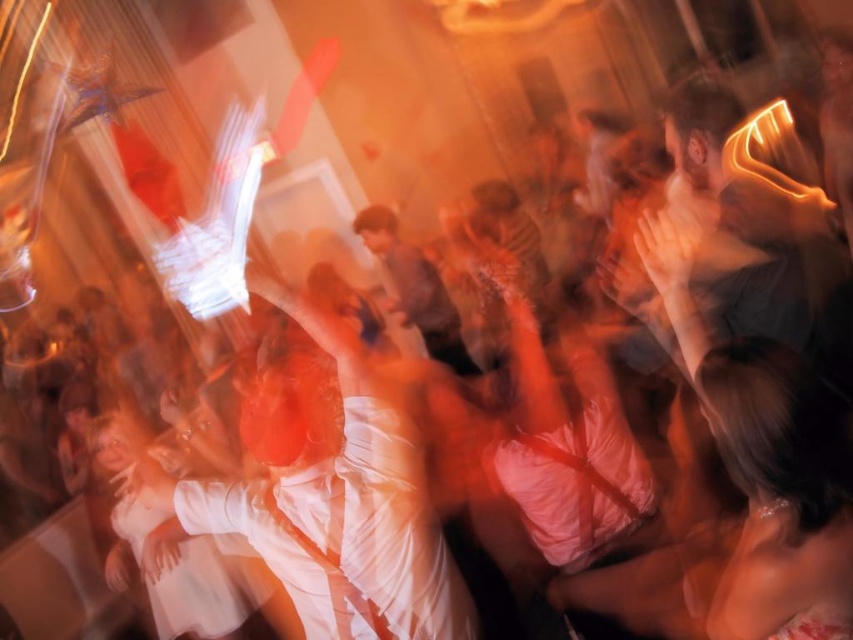
Is white satin dress at center further to the viewer compared to matte brown shirt at center?

No, it is not.

Between white satin dress at center and matte brown shirt at center, which one has more height?

matte brown shirt at center is taller.

Does point (454, 572) lie in front of point (457, 364)?

Yes, point (454, 572) is closer to viewer.

In order to click on white satin dress at center in this screenshot , I will do `click(331, 500)`.